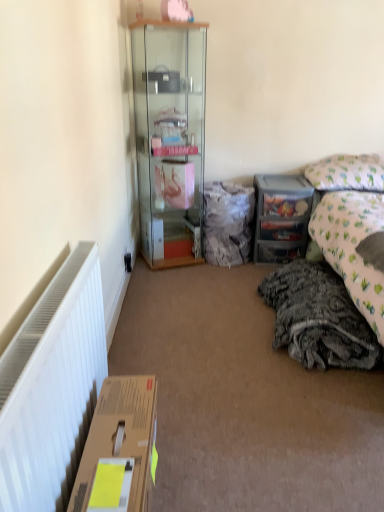
Question: Is brown cardboard box at lower left next to clear plastic drawers at center right?

Choices:
 (A) yes
 (B) no

Answer: (B)

Question: Is brown cardboard box at lower left surrounding clear plastic drawers at center right?

Choices:
 (A) no
 (B) yes

Answer: (A)

Question: Is brown cardboard box at lower left behind clear plastic drawers at center right?

Choices:
 (A) yes
 (B) no

Answer: (B)

Question: From a real-world perspective, is brown cardboard box at lower left on clear plastic drawers at center right?

Choices:
 (A) no
 (B) yes

Answer: (A)

Question: Considering the relative positions of brown cardboard box at lower left and clear plastic drawers at center right in the image provided, is brown cardboard box at lower left to the right of clear plastic drawers at center right from the viewer's perspective?

Choices:
 (A) yes
 (B) no

Answer: (B)

Question: Based on their positions, is black plastic power outlet at lower left located to the left or right of patterned fabric pillow at upper right?

Choices:
 (A) right
 (B) left

Answer: (B)

Question: Is black plastic power outlet at lower left bigger or smaller than patterned fabric pillow at upper right?

Choices:
 (A) big
 (B) small

Answer: (B)

Question: Is point (125, 257) closer or farther from the camera than point (347, 166)?

Choices:
 (A) farther
 (B) closer

Answer: (B)

Question: In terms of height, does black plastic power outlet at lower left look taller or shorter compared to patterned fabric pillow at upper right?

Choices:
 (A) tall
 (B) short

Answer: (B)

Question: Is brown cardboard box at lower left taller or shorter than fuzzy fabric bag at center?

Choices:
 (A) tall
 (B) short

Answer: (B)

Question: From the image's perspective, is brown cardboard box at lower left located above or below fuzzy fabric bag at center?

Choices:
 (A) below
 (B) above

Answer: (A)

Question: Looking at the image, does brown cardboard box at lower left seem bigger or smaller compared to fuzzy fabric bag at center?

Choices:
 (A) small
 (B) big

Answer: (A)

Question: Which is correct: brown cardboard box at lower left is inside fuzzy fabric bag at center, or outside of it?

Choices:
 (A) inside
 (B) outside

Answer: (B)

Question: From the image's perspective, is fuzzy fabric bag at center positioned above or below patterned fabric pillow at upper right?

Choices:
 (A) above
 (B) below

Answer: (B)

Question: Is fuzzy fabric bag at center in front of or behind patterned fabric pillow at upper right in the image?

Choices:
 (A) behind
 (B) front

Answer: (A)